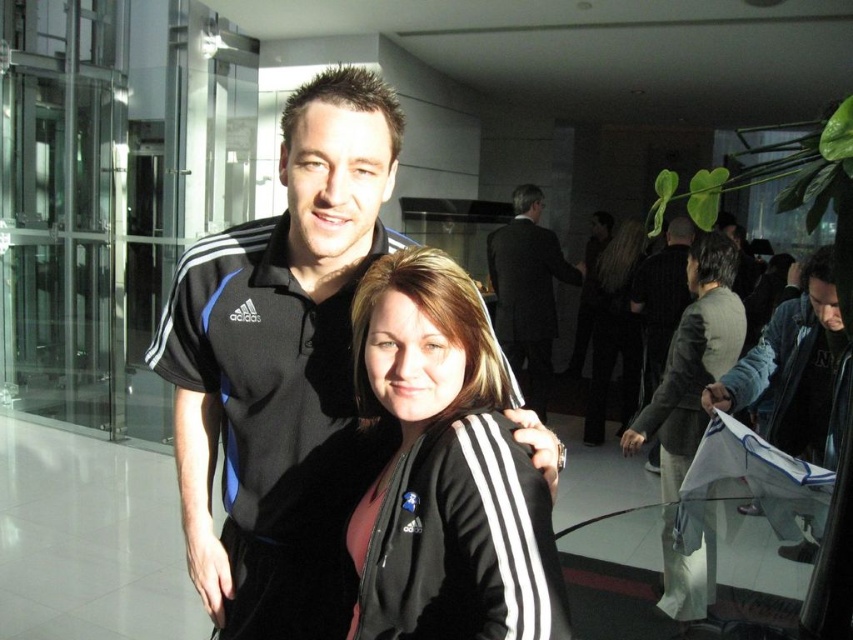
Is the position of black adidas polo shirt at center more distant than that of dark suit at center?

No.

Who is more distant from viewer, (274,616) or (514,259)?

The point (514,259) is behind.

Identify the location of black adidas polo shirt at center. The width and height of the screenshot is (853, 640). (283, 371).

Based on the photo, does dark suit at center have a smaller size compared to black fabric jacket at center?

Incorrect, dark suit at center is not smaller in size than black fabric jacket at center.

Between dark suit at center and black fabric jacket at center, which one is positioned higher?

dark suit at center is above.

Image resolution: width=853 pixels, height=640 pixels. Find the location of `dark suit at center`. dark suit at center is located at coordinates (527, 292).

Is black adidas polo shirt at center shorter than blue denim jacket at right?

No, black adidas polo shirt at center is not shorter than blue denim jacket at right.

Which is behind, point (280, 532) or point (779, 449)?

The point (779, 449) is behind.

Who is more distant from viewer, (398,124) or (843,388)?

The point (843,388) is behind.

Image resolution: width=853 pixels, height=640 pixels. What are the coordinates of `black adidas polo shirt at center` in the screenshot? It's located at (283, 371).